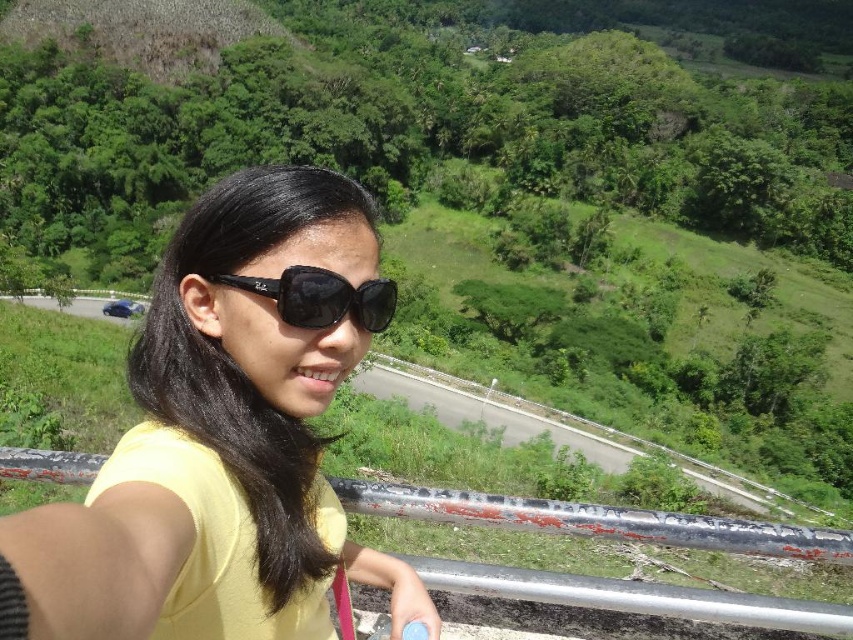
Is gray asphalt road at center to the left of black reflective sunglasses at center from the viewer's perspective?

→ No, gray asphalt road at center is not to the left of black reflective sunglasses at center.

Locate an element on the screen. gray asphalt road at center is located at coordinates (560, 429).

The image size is (853, 640). What do you see at coordinates (560, 429) in the screenshot?
I see `gray asphalt road at center` at bounding box center [560, 429].

I want to click on gray asphalt road at center, so [x=560, y=429].

Is rusty metal rail at center in front of black reflective sunglasses at center?

No, it is not.

This screenshot has width=853, height=640. What are the coordinates of `rusty metal rail at center` in the screenshot? It's located at (596, 520).

Looking at this image, does yellow matte shirt at center have a greater width compared to gray asphalt road at center?

In fact, yellow matte shirt at center might be narrower than gray asphalt road at center.

Is yellow matte shirt at center behind gray asphalt road at center?

No.

Who is more forward, (97,502) or (521,426)?

Point (97,502) is more forward.

Find the location of `yellow matte shirt at center`. yellow matte shirt at center is located at coordinates (224, 436).